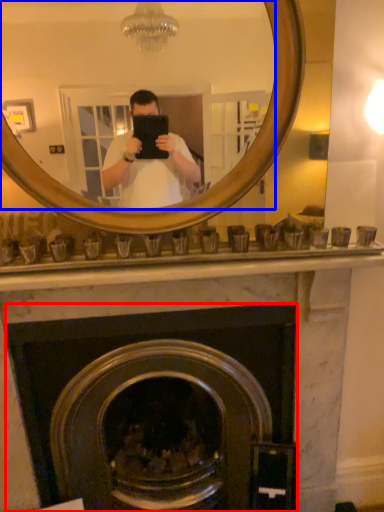
Question: Which of the following is the closest to the observer, fireplace (highlighted by a red box) or mirror (highlighted by a blue box)?

Choices:
 (A) fireplace
 (B) mirror

Answer: (B)